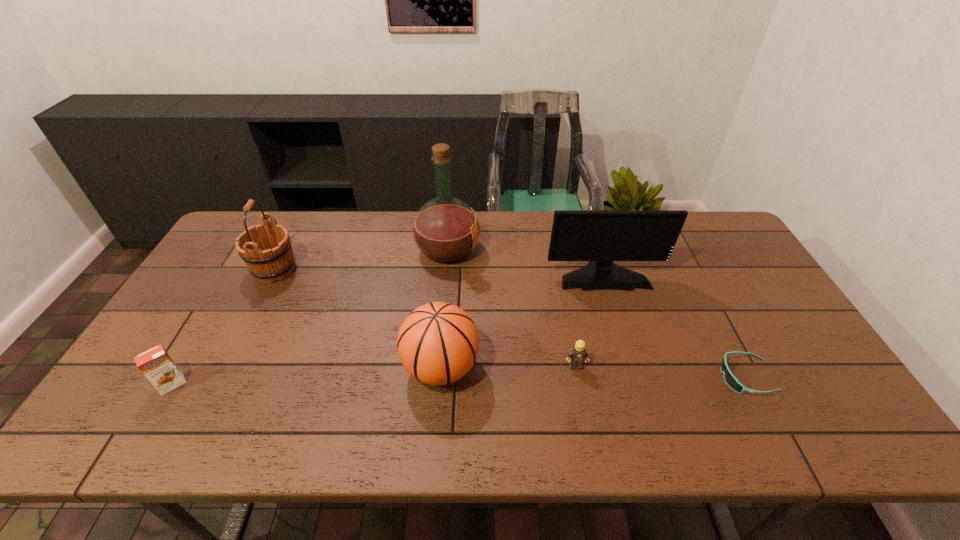
The height and width of the screenshot is (540, 960). Identify the location of vacant area situated 0.190m on the screen side of the monitor. (624, 341).

This screenshot has height=540, width=960. In order to click on vacant position located on the left of the basketball in this screenshot , I will do `click(303, 367)`.

You are a GUI agent. You are given a task and a screenshot of the screen. Output one action in this format:
    pyautogui.click(x=<x>, y=<y>)
    Task: Click on the free space located on the back of the orange juice
    The width and height of the screenshot is (960, 540).
    Given the screenshot: What is the action you would take?
    pyautogui.click(x=214, y=314)

You are a GUI agent. You are given a task and a screenshot of the screen. Output one action in this format:
    pyautogui.click(x=<x>, y=<y>)
    Task: Click on the free space located in front of the Lego
    Image resolution: width=960 pixels, height=540 pixels.
    Given the screenshot: What is the action you would take?
    pyautogui.click(x=584, y=409)

The height and width of the screenshot is (540, 960). Find the location of `free point located 0.240m on the front-facing side of the shortest object`. free point located 0.240m on the front-facing side of the shortest object is located at coordinates (623, 377).

Locate an element on the screen. The image size is (960, 540). free space located 0.250m on the front-facing side of the shortest object is located at coordinates (619, 377).

The height and width of the screenshot is (540, 960). I want to click on vacant area situated on the front-facing side of the shortest object, so click(652, 377).

Image resolution: width=960 pixels, height=540 pixels. I want to click on liquor present at the far edge, so click(445, 229).

At what (x,y) coordinates should I click in order to perform the action: click on wine bucket present at the far edge. Please return your answer as a coordinate pair (x, y). This screenshot has width=960, height=540. Looking at the image, I should click on (266, 249).

Locate an element on the screen. Image resolution: width=960 pixels, height=540 pixels. wine bucket that is at the left edge is located at coordinates (266, 249).